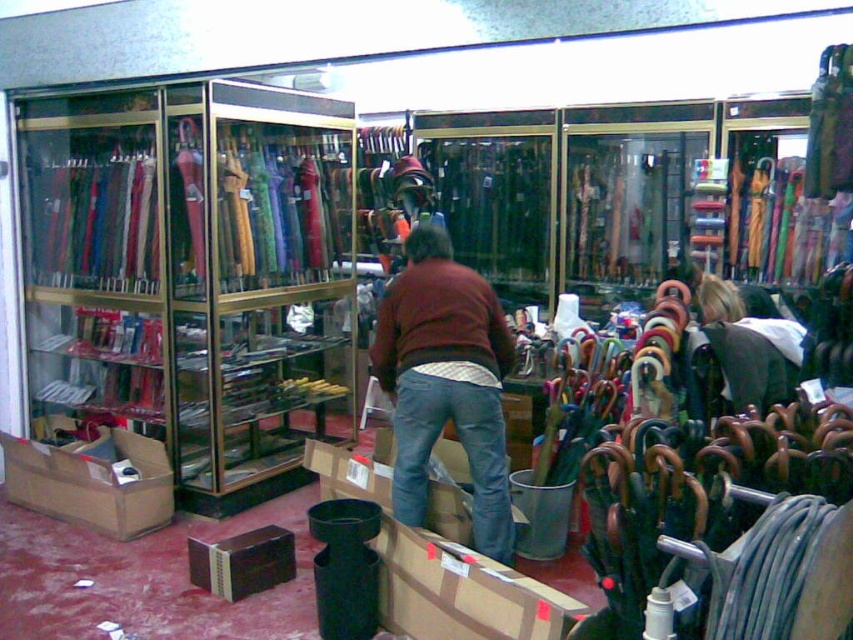
Question: Is metallic glass umbrella stand at left to the right of brown cardboard box at center from the viewer's perspective?

Choices:
 (A) yes
 (B) no

Answer: (B)

Question: Which object appears closest to the camera in this image?

Choices:
 (A) brown sweater at center
 (B) cardboard box at lower left
 (C) white fabric umbrella at right

Answer: (C)

Question: Which of these objects is positioned closest to the cardboard box at lower left?

Choices:
 (A) brown cardboard box at center
 (B) brown sweater at center
 (C) white fabric umbrella at right
 (D) metallic glass umbrella stand at left

Answer: (D)

Question: Considering the relative positions of brown cardboard box at center and white fabric umbrella at right in the image provided, where is brown cardboard box at center located with respect to white fabric umbrella at right?

Choices:
 (A) right
 (B) left

Answer: (B)

Question: Can you confirm if brown sweater at center is wider than white fabric umbrella at right?

Choices:
 (A) no
 (B) yes

Answer: (A)

Question: Which point is closer to the camera?

Choices:
 (A) metallic glass umbrella stand at left
 (B) brown sweater at center
 (C) cardboard box at lower left

Answer: (B)